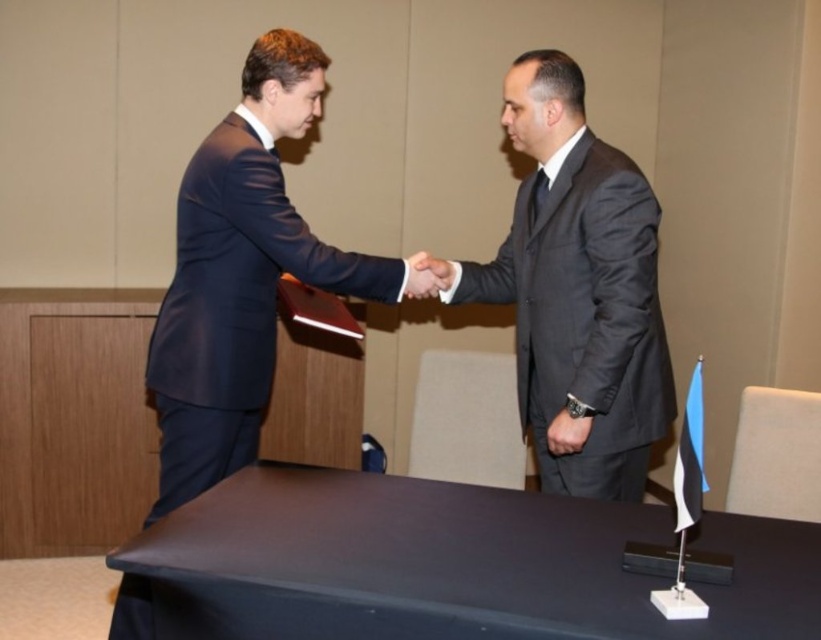
Question: Which object is positioned farthest from the black leather wristwatch at center?

Choices:
 (A) matte black hand at center
 (B) matte black suit at center
 (C) black matte table at center

Answer: (C)

Question: Can you confirm if matte black suit at center is wider than matte black hand at center?

Choices:
 (A) yes
 (B) no

Answer: (A)

Question: Which point is farther from the camera taking this photo?

Choices:
 (A) (425, 289)
 (B) (562, 416)

Answer: (A)

Question: Estimate the real-world distances between objects in this image. Which object is farther from the black matte table at center?

Choices:
 (A) matte black hand at center
 (B) matte black suit at center
 (C) black leather wristwatch at center

Answer: (A)

Question: Is matte black suit at center bigger than matte black hand at center?

Choices:
 (A) yes
 (B) no

Answer: (A)

Question: In this image, where is matte black suit at center located relative to matte black hand at center?

Choices:
 (A) left
 (B) right

Answer: (B)